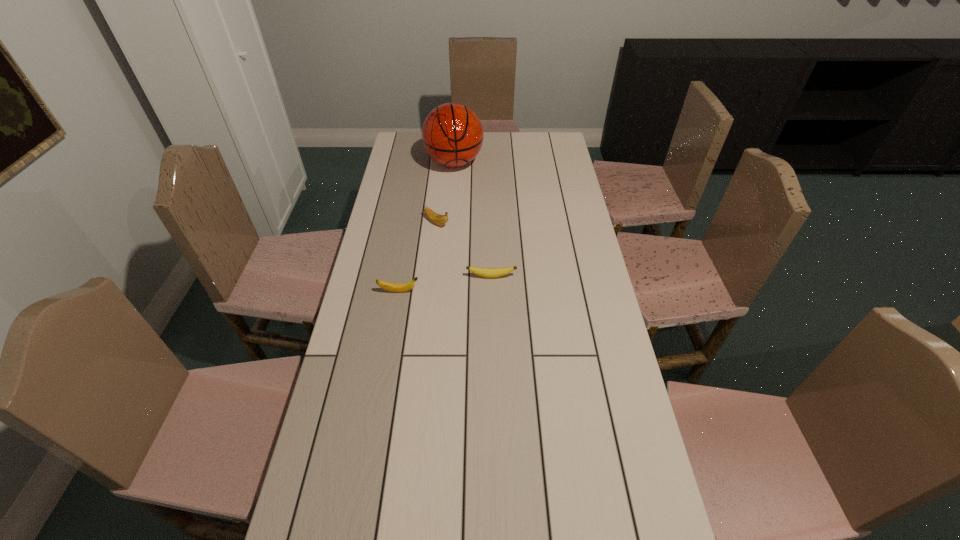
The height and width of the screenshot is (540, 960). I want to click on object that is at the far edge, so click(x=452, y=134).

Image resolution: width=960 pixels, height=540 pixels. Identify the location of basketball at the left edge. (452, 134).

This screenshot has height=540, width=960. In order to click on banana present at the left edge in this screenshot , I will do `click(392, 287)`.

At what (x,y) coordinates should I click in order to perform the action: click on object that is at the far left corner. Please return your answer as a coordinate pair (x, y). The height and width of the screenshot is (540, 960). Looking at the image, I should click on (452, 134).

This screenshot has height=540, width=960. In the image, there is a desktop. Find the location of `vacant space at the far edge`. vacant space at the far edge is located at coordinates (510, 150).

At what (x,y) coordinates should I click in order to perform the action: click on free spot at the left edge of the desktop. Please return your answer as a coordinate pair (x, y). Looking at the image, I should click on (389, 180).

Locate an element on the screen. free space at the right edge is located at coordinates (574, 431).

The image size is (960, 540). In the image, there is a desktop. Find the location of `vacant space at the far left corner`. vacant space at the far left corner is located at coordinates (397, 151).

Find the location of a particular element. This screenshot has height=540, width=960. vacant space that is in between the farthest banana and the shortest object is located at coordinates (464, 249).

Locate an element on the screen. free spot between the rightmost banana and the basketball is located at coordinates (472, 219).